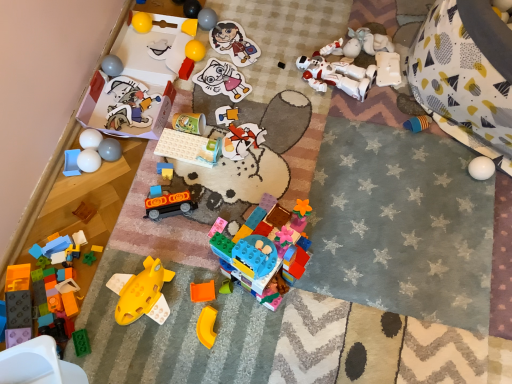
At what (x,y) coordinates should I click in order to perform the action: click on unoccupied area behind matte plastic sticker at upper center, marked as the fourth toy in a right-to-left arrangement. Please return your answer as a coordinate pair (x, y). Looking at the image, I should click on [x=233, y=18].